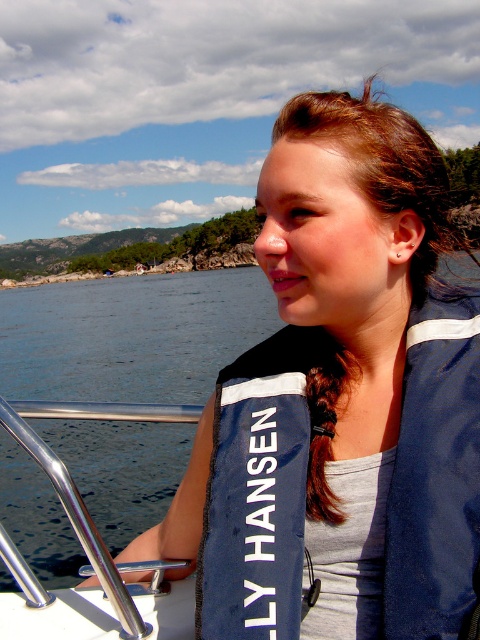
You are a photographer trying to capture the best shot of the two points in the scene. Which point, point (273,508) or point (424,406), is closer to your camera position?

Point (424,406) is closer to the camera because it is less further than point (273,508).

You are on a boat and want to secure your belongings near the navy blue life vest at center and the brushed metal railing at lower left. Which object should you place your items closer to if you want them to be on the right side of the boat?

You should place your items closer to the navy blue life vest at center because it is positioned to the right of the brushed metal railing at lower left, making it the better option for placing items on the right side of the boat.

You are a photographer taking a picture of the person in the boat. You want to make sure both the navy blue life vest at center and the navy blue fabric life jacket at center are visible in the frame. Which object should you position closer to the left side of your camera viewfinder to ensure both are included?

You should position the navy blue life vest at center closer to the left side of your camera viewfinder since it is already to the left of the navy blue fabric life jacket at center. This arrangement will naturally place both objects within the frame without overlapping.